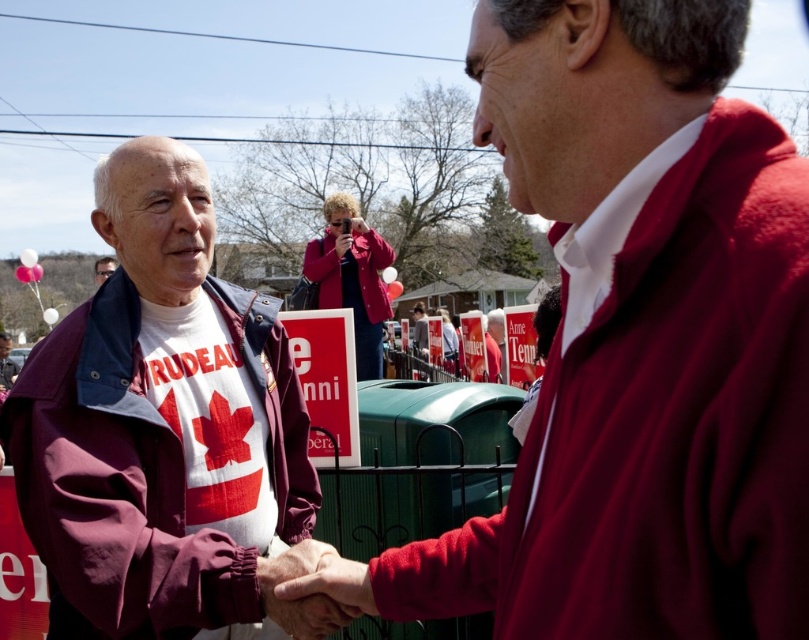
Question: Does maroon fleece jacket at center have a smaller size compared to matte maroon jacket at center?

Choices:
 (A) no
 (B) yes

Answer: (B)

Question: Can you confirm if smooth leather hand at center is positioned below matte maroon jacket at center?

Choices:
 (A) no
 (B) yes

Answer: (B)

Question: Can you confirm if smooth leather hand at center is wider than matte maroon jacket at center?

Choices:
 (A) no
 (B) yes

Answer: (A)

Question: Which is farther from the maroon fleece jacket at center?

Choices:
 (A) smooth leather hand at center
 (B) matte maroon jacket at center
 (C) maroon fabric santa claus at left
 (D) pink fabric camera at center

Answer: (D)

Question: Which object appears closest to the camera in this image?

Choices:
 (A) pink fabric camera at center
 (B) maroon fabric santa claus at left
 (C) maroon fleece jacket at center

Answer: (C)

Question: Based on their relative distances, which object is farther from the maroon fabric santa claus at left?

Choices:
 (A) maroon fleece jacket at center
 (B) smooth leather hand at center
 (C) pink fabric camera at center
 (D) matte maroon jacket at center

Answer: (C)